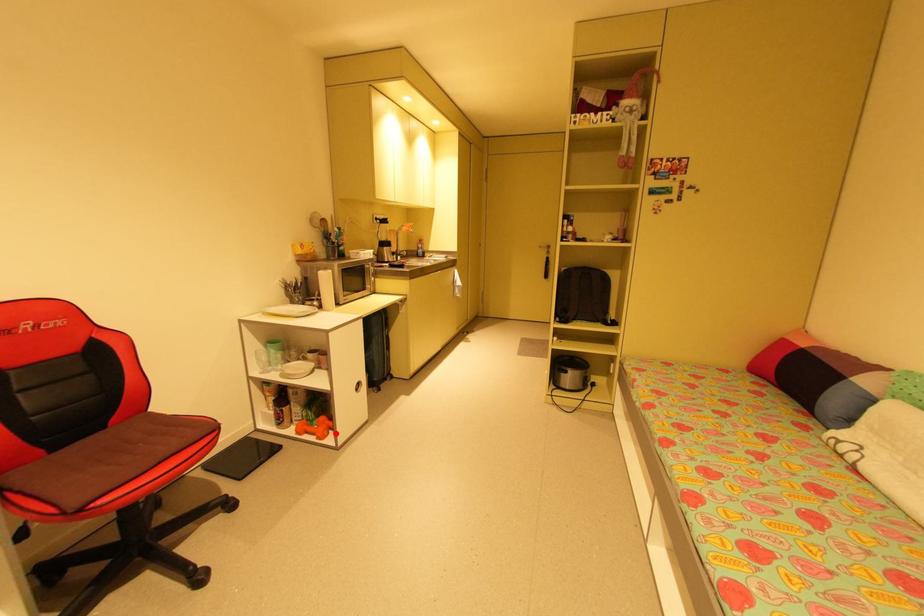
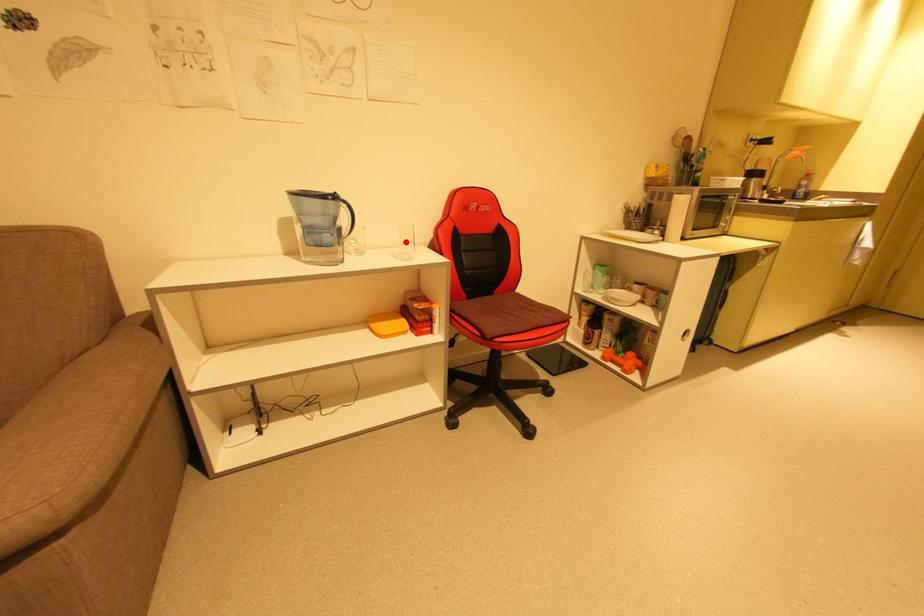
I am providing you with two images of the same scene from different viewpoints. A red point is marked on the first image and another point is marked on the second image. Is the red point in image1 aligned with the point shown in image2?

No